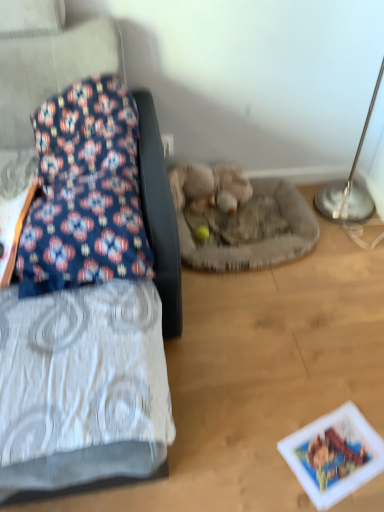
Question: Is floral fabric cushion at left turned away from silver metallic table lamp at upper right?

Choices:
 (A) no
 (B) yes

Answer: (A)

Question: Is floral fabric cushion at left to the left of silver metallic table lamp at upper right from the viewer's perspective?

Choices:
 (A) yes
 (B) no

Answer: (A)

Question: From a real-world perspective, is floral fabric cushion at left positioned under silver metallic table lamp at upper right based on gravity?

Choices:
 (A) yes
 (B) no

Answer: (B)

Question: Is silver metallic table lamp at upper right a part of floral fabric cushion at left?

Choices:
 (A) no
 (B) yes

Answer: (A)

Question: Can we say floral fabric cushion at left lies outside silver metallic table lamp at upper right?

Choices:
 (A) no
 (B) yes

Answer: (B)

Question: In terms of width, does floral fabric cushion at left look wider or thinner when compared to fuzzy beige stuffed animal at center?

Choices:
 (A) wide
 (B) thin

Answer: (A)

Question: From a real-world perspective, relative to fuzzy beige stuffed animal at center, is floral fabric cushion at left vertically above or below?

Choices:
 (A) below
 (B) above

Answer: (B)

Question: Is floral fabric cushion at left inside the boundaries of fuzzy beige stuffed animal at center, or outside?

Choices:
 (A) inside
 (B) outside

Answer: (B)

Question: Considering the positions of floral fabric cushion at left and fuzzy beige stuffed animal at center in the image, is floral fabric cushion at left taller or shorter than fuzzy beige stuffed animal at center?

Choices:
 (A) short
 (B) tall

Answer: (B)

Question: Is point (350, 209) positioned closer to the camera than point (119, 227)?

Choices:
 (A) closer
 (B) farther

Answer: (B)

Question: Based on their positions, is silver metallic table lamp at upper right located to the left or right of floral fabric pillow at left?

Choices:
 (A) left
 (B) right

Answer: (B)

Question: Is silver metallic table lamp at upper right inside the boundaries of floral fabric pillow at left, or outside?

Choices:
 (A) outside
 (B) inside

Answer: (A)

Question: Is silver metallic table lamp at upper right taller or shorter than floral fabric pillow at left?

Choices:
 (A) short
 (B) tall

Answer: (B)

Question: Considering the positions of point (92, 116) and point (246, 201), is point (92, 116) closer or farther from the camera than point (246, 201)?

Choices:
 (A) farther
 (B) closer

Answer: (B)

Question: In the image, is floral fabric pillow at left on the left side or the right side of fuzzy beige stuffed animal at center?

Choices:
 (A) left
 (B) right

Answer: (A)